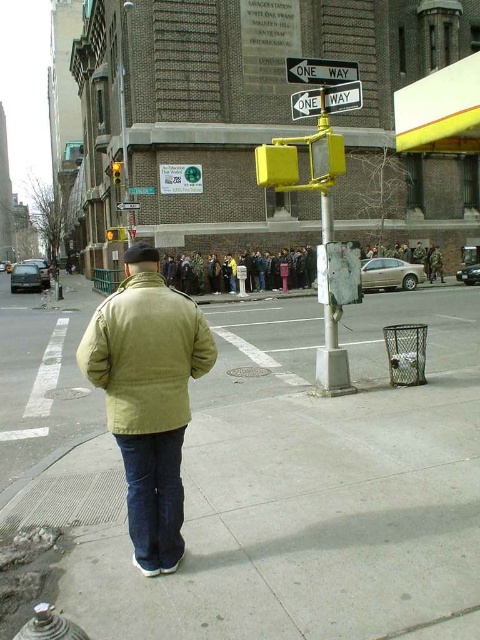
You are standing at the point marked as point [319,81] and want to walk to the group of people across the street. The distance between you and the group is 7.38 meters. If you can walk 1.5 meters per second, how many seconds will it take you to reach them?

The distance between you and the group is 7.38 meters. At a walking speed of 1.5 meters per second, it will take approximately 4.92 seconds to reach them.

You are a delivery person needing to turn around your vehicle on this street. Considering the distance between you and the black plastic one way sign at upper center, is there enough space to safely make a U turn? Please provide a detailed analysis based on the distance provided.

The black plastic one way sign at upper center is 7.02 meters away from the viewer. Typically, a safe U turn requires at least 10 meters of clear space. Since the distance here is less than that, there isn not enough space to safely make a U turn.

You are a delivery driver who needs to navigate around the yellow plastic pole at center. You see the black plastic one way sign at upper center above it. Which direction should you drive to follow the one way sign?

The black plastic one way sign at upper center is positioned over the yellow plastic pole at center, so you should drive in the direction indicated by the one way sign above the pole to comply with traffic rules.